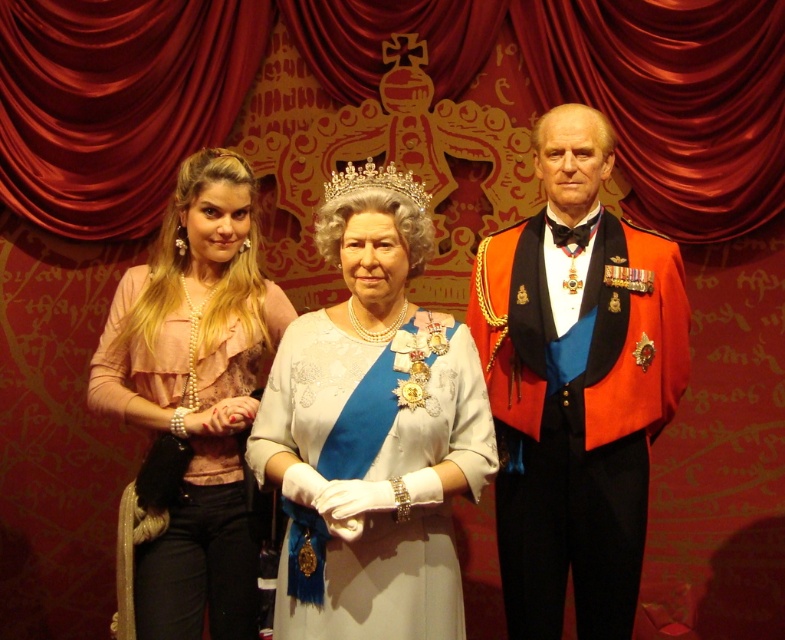
Question: Considering the real-world distances, which object is closest to the pearl necklace at left?

Choices:
 (A) shiny red fabric at right
 (B) matte white wax figure at center

Answer: (B)

Question: Which object appears closest to the camera in this image?

Choices:
 (A) matte white wax figure at center
 (B) gold metallic tiara at center
 (C) red velvet curtain at center
 (D) shiny red fabric at right

Answer: (B)

Question: In this image, where is red velvet curtain at center located relative to gold metallic tiara at center?

Choices:
 (A) right
 (B) left

Answer: (B)

Question: Is white satin dress at center to the left of pearl necklace at left from the viewer's perspective?

Choices:
 (A) no
 (B) yes

Answer: (A)

Question: Which point is closer to the camera?

Choices:
 (A) gold metallic tiara at center
 (B) shiny red fabric at right
 (C) pearl necklace at left

Answer: (C)

Question: Is white satin dress at center in front of pearl necklace at left?

Choices:
 (A) yes
 (B) no

Answer: (A)